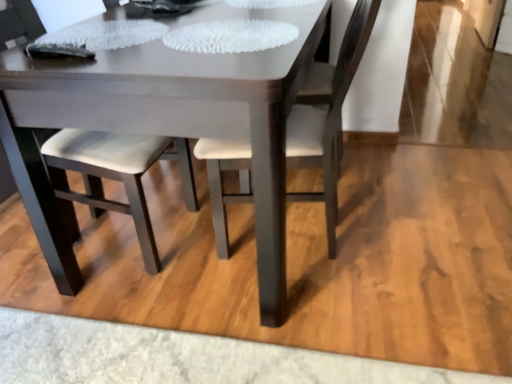
The image size is (512, 384). In order to click on free space in front of matte white chair at center, placed as the 1th chair when sorted from left to right in this screenshot , I will do `click(93, 334)`.